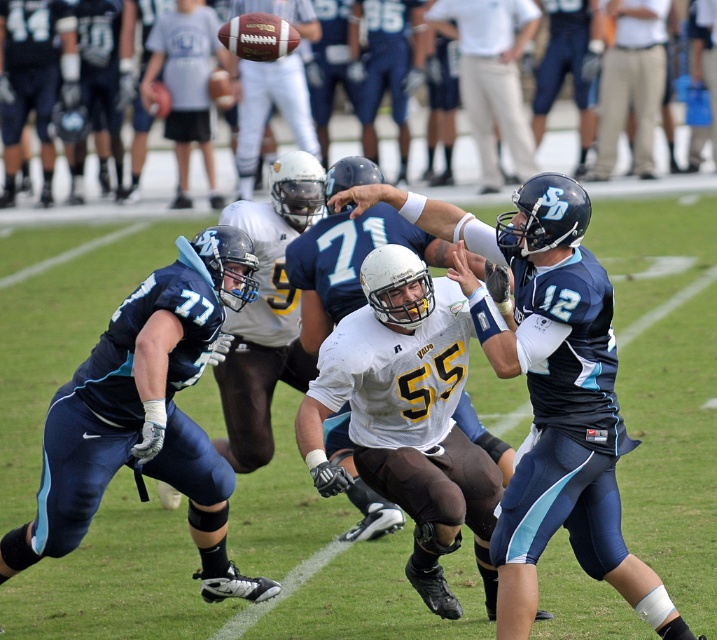
You are a sports analyst watching the game. You notice two players in the frame, the white matte jersey at center and the dark blue uniform at left. Which player takes up more space in the image?

The white matte jersey at center takes up more space in the image because its width surpasses that of the dark blue uniform at left.

You are a sports analyst watching the game. You notice two white items at the center of the field. Which one is closer to the camera, the white matte jersey at center or the white matte helmet at center?

The white matte jersey at center is in front of the white matte helmet at center, so the white matte jersey at center is closer to the camera.

In the scene shown: Based on the scene description, which object is positioned higher in the image between the light blue jersey at center and the matte white helmet at center?

The light blue jersey at center is positioned higher than the matte white helmet at center in the image.